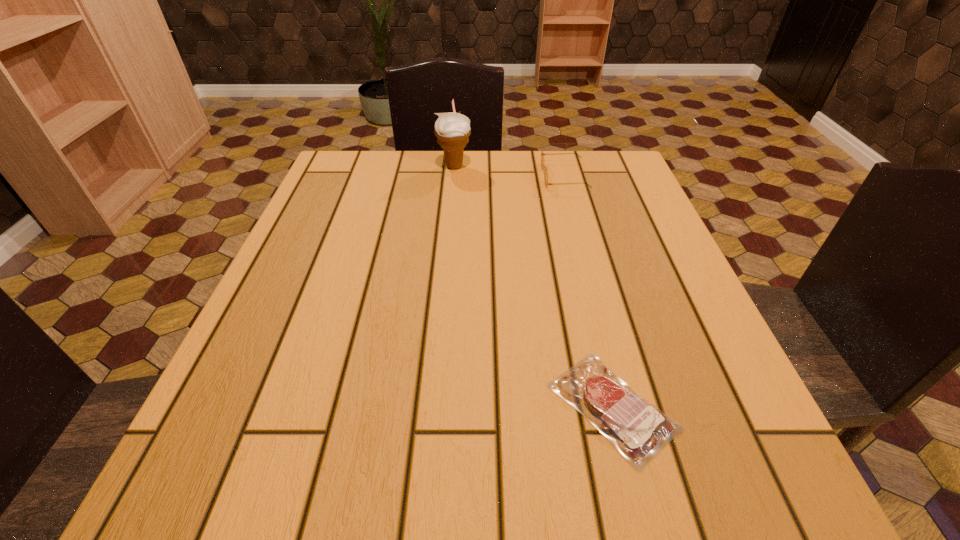
Where is `vacant space at the far right corner of the desktop`? The image size is (960, 540). vacant space at the far right corner of the desktop is located at coordinates (609, 156).

Find the location of a particular element. vacant region at the near right corner of the desktop is located at coordinates (720, 492).

In order to click on free space that is in between the second tallest object and the nearest object in this screenshot , I will do `click(588, 291)`.

The width and height of the screenshot is (960, 540). Identify the location of vacant space in between the second shortest object and the icecream. (510, 171).

Locate an element on the screen. The image size is (960, 540). free space that is in between the tallest object and the second tallest object is located at coordinates (510, 171).

Image resolution: width=960 pixels, height=540 pixels. In order to click on vacant space that is in between the tallest object and the shortest object in this screenshot , I will do `click(534, 286)`.

The width and height of the screenshot is (960, 540). In order to click on vacant space in between the sunglasses and the steak in this screenshot , I will do `click(588, 291)`.

I want to click on unoccupied area between the second tallest object and the leftmost object, so click(510, 171).

The image size is (960, 540). In order to click on vacant space that is in between the leftmost object and the nearest object in this screenshot , I will do `click(534, 286)`.

The image size is (960, 540). Identify the location of free spot between the sunglasses and the nearest object. (588, 291).